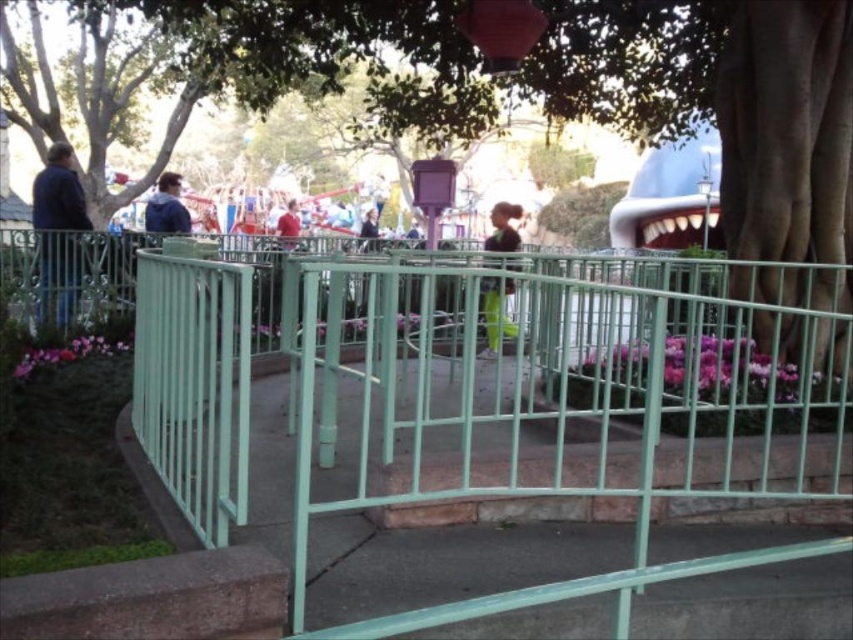
You are a photographer positioned at the entrance of the theme park. You notice two visitors wearing a blue fabric jacket at upper left and a red matte shirt at center. Which one appears narrower in the photo?

The blue fabric jacket at upper left appears narrower compared to the red matte shirt at center.

You are a photographer standing at the theme park pathway. You see a person wearing a dark blue jacket at left and another wearing a light brown leather jacket at center. Which jacket is shorter in height?

The dark blue jacket at left is shorter than the light brown leather jacket at center.

You are a visitor in the theme park and want to find someone wearing a blue fabric jacket at upper left. Which direction should you look relative to the light brown leather jacket at center?

The blue fabric jacket at upper left is located below the light brown leather jacket at center, so you should look downward from the light brown leather jacket at center to find the blue fabric jacket at upper left.